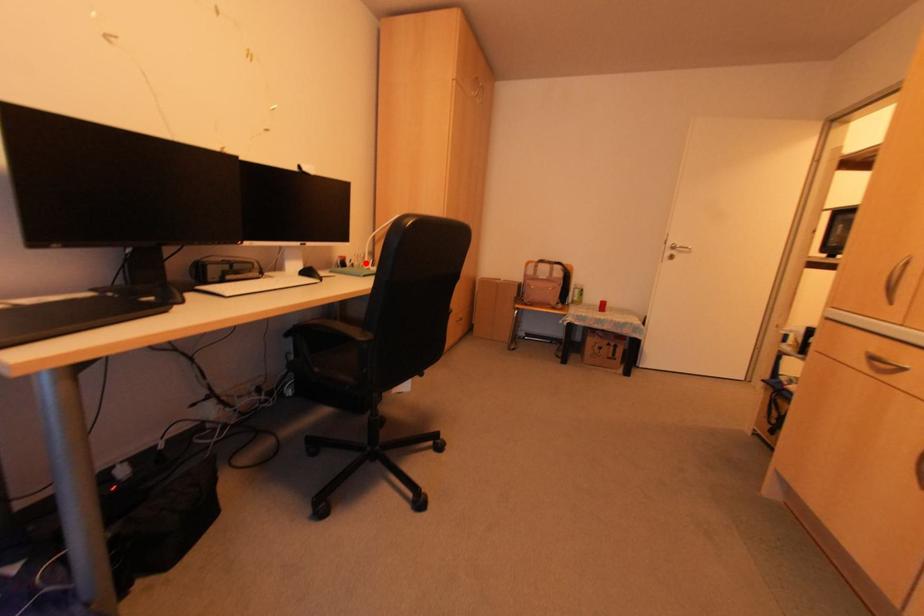
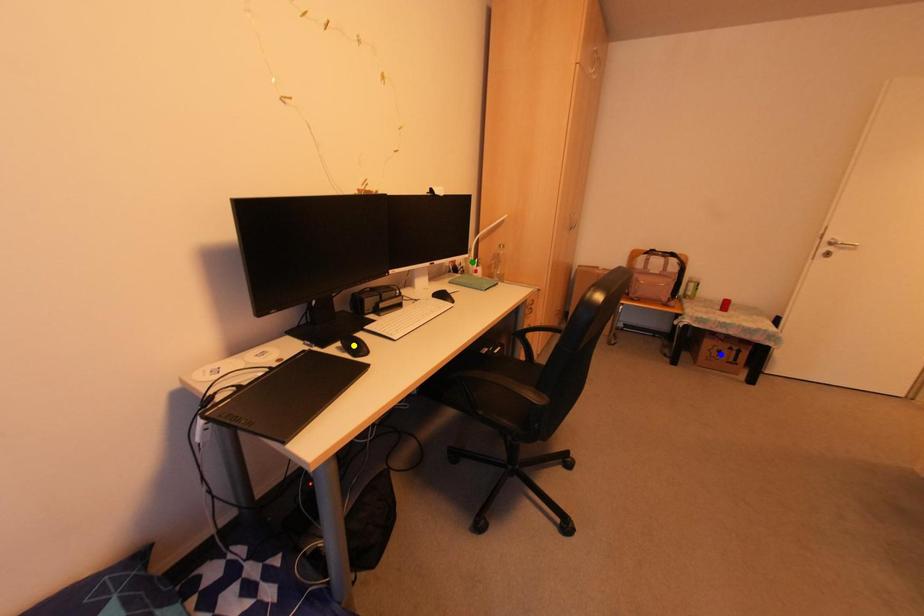
Question: I am providing you with two images of the same scene from different viewpoints. A red point is marked on the first image. You are given multiple points on the second image. Which mark in image 2 goes with the point in image 1?

Choices:
 (A) blue point
 (B) green point
 (C) yellow point

Answer: (B)